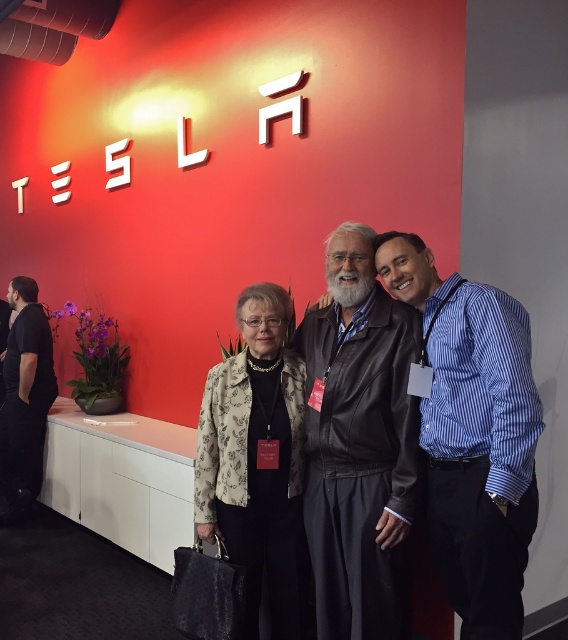
In the scene shown: Can you confirm if blue striped shirt at center is bigger than floral-patterned fabric at center?

Yes.

What do you see at coordinates (474, 435) in the screenshot? This screenshot has height=640, width=568. I see `blue striped shirt at center` at bounding box center [474, 435].

You are a GUI agent. You are given a task and a screenshot of the screen. Output one action in this format:
    pyautogui.click(x=<x>, y=<y>)
    Task: Click on the blue striped shirt at center
    This screenshot has height=640, width=568.
    Given the screenshot: What is the action you would take?
    pyautogui.click(x=474, y=435)

In the scene shown: Is blue striped shirt at center closer to camera compared to black leather jacket at left?

Yes, blue striped shirt at center is in front of black leather jacket at left.

Can you confirm if blue striped shirt at center is thinner than black leather jacket at left?

No.

Locate an element on the screen. Image resolution: width=568 pixels, height=640 pixels. blue striped shirt at center is located at coordinates (474, 435).

Find the location of `blue striped shirt at center`. blue striped shirt at center is located at coordinates (474, 435).

Can you confirm if leather jacket at center is positioned above black leather jacket at left?

Indeed, leather jacket at center is positioned over black leather jacket at left.

The width and height of the screenshot is (568, 640). What are the coordinates of `leather jacket at center` in the screenshot? It's located at (358, 442).